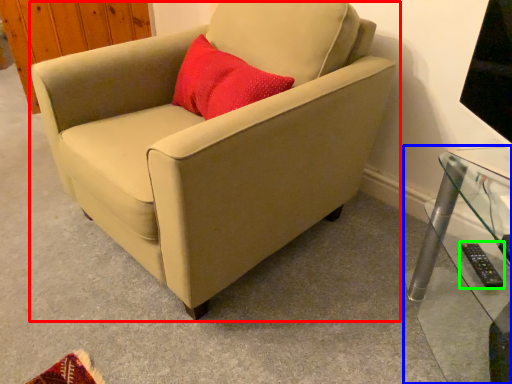
Question: Considering the real-world distances, which object is closest to chair (highlighted by a red box)? table (highlighted by a blue box) or remote (highlighted by a green box).

Choices:
 (A) table
 (B) remote

Answer: (A)